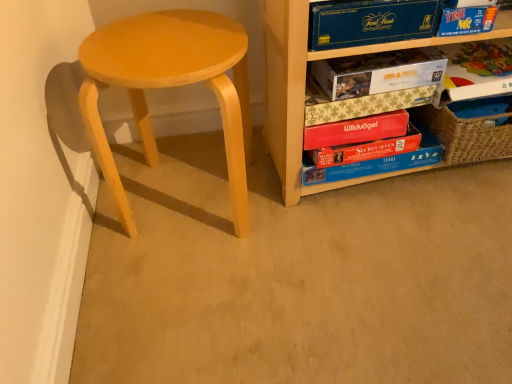
The image size is (512, 384). Identify the location of white paper at upper right, which is counted as the second paperback book, starting from the top. (475, 71).

The width and height of the screenshot is (512, 384). What do you see at coordinates (356, 130) in the screenshot?
I see `red matte wildvögel book at center, the fifth paperback book in the top-to-bottom sequence` at bounding box center [356, 130].

Describe the element at coordinates (359, 103) in the screenshot. I see `matte cardboard puzzle box at center-right, which is the fourth paperback book from bottom to top` at that location.

I want to click on blue cardboard book at upper right, which appears as the first paperback book when viewed from the top, so click(x=369, y=22).

I want to click on white paper at upper right, which is counted as the second paperback book, starting from the top, so click(475, 71).

Could you tell me if matte yellow stool at left is turned towards wooden puzzle boxes at right?

No, matte yellow stool at left is not turned towards wooden puzzle boxes at right.

Does point (242, 87) lie in front of point (276, 84)?

Yes, it is in front of point (276, 84).

What's the angular difference between matte yellow stool at left and wooden puzzle boxes at right's facing directions?

The angular difference between matte yellow stool at left and wooden puzzle boxes at right is 0.928 degrees.

Is wooden puzzle boxes at right a part of matte yellow stool at left?

No, wooden puzzle boxes at right is not a part of matte yellow stool at left.

From the picture: Can you see matte cardboard puzzle box at center-right, the fourth paperback book from the top, touching blue cardboard puzzle box at center, marked as the 7th paperback book in a top-to-bottom arrangement?

No, matte cardboard puzzle box at center-right, the fourth paperback book from the top, is not in contact with blue cardboard puzzle box at center, marked as the 7th paperback book in a top-to-bottom arrangement.

Considering their positions, is matte cardboard puzzle box at center-right, which is the fourth paperback book from bottom to top, located in front of or behind blue cardboard puzzle box at center, placed as the first paperback book when sorted from bottom to top?

Clearly, matte cardboard puzzle box at center-right, which is the fourth paperback book from bottom to top, is in front of blue cardboard puzzle box at center, placed as the first paperback book when sorted from bottom to top.

Considering the points (350, 105) and (432, 156), which point is behind, point (350, 105) or point (432, 156)?

The point (432, 156) is farther from the camera.

In terms of height, does matte cardboard puzzle box at center-right, which is the fourth paperback book from bottom to top, look taller or shorter compared to blue cardboard puzzle box at center, placed as the first paperback book when sorted from bottom to top?

Considering their sizes, matte cardboard puzzle box at center-right, which is the fourth paperback book from bottom to top, has less height than blue cardboard puzzle box at center, placed as the first paperback book when sorted from bottom to top.

The image size is (512, 384). I want to click on the 5th paperback book in front of the red cardboard book at center, the 6th paperback book from the top, so click(369, 22).

Is red cardboard book at center, placed as the second paperback book when sorted from bottom to top, aimed at blue cardboard book at upper right, which appears as the first paperback book when viewed from the top?

No, red cardboard book at center, placed as the second paperback book when sorted from bottom to top, is not aimed at blue cardboard book at upper right, which appears as the first paperback book when viewed from the top.

From the image's perspective, is red cardboard book at center, placed as the second paperback book when sorted from bottom to top, beneath blue cardboard book at upper right, which appears as the first paperback book when viewed from the top?

Indeed, from the image's perspective, red cardboard book at center, placed as the second paperback book when sorted from bottom to top, is shown beneath blue cardboard book at upper right, which appears as the first paperback book when viewed from the top.

Is blue cardboard puzzle box at center, placed as the first paperback book when sorted from bottom to top, bigger or smaller than wooden puzzle boxes at right?

Considering their sizes, blue cardboard puzzle box at center, placed as the first paperback book when sorted from bottom to top, takes up less space than wooden puzzle boxes at right.

How far apart are blue cardboard puzzle box at center, placed as the first paperback book when sorted from bottom to top, and wooden puzzle boxes at right?

blue cardboard puzzle box at center, placed as the first paperback book when sorted from bottom to top, is 6.24 inches from wooden puzzle boxes at right.

Is blue cardboard puzzle box at center, placed as the first paperback book when sorted from bottom to top, wider or thinner than wooden puzzle boxes at right?

blue cardboard puzzle box at center, placed as the first paperback book when sorted from bottom to top, is thinner than wooden puzzle boxes at right.

The image size is (512, 384). In order to click on shelf located above the blue cardboard puzzle box at center, placed as the first paperback book when sorted from bottom to top (from the image's perspective) in this screenshot , I will do click(x=304, y=86).

From the image's perspective, is blue cardboard puzzle box at center, placed as the first paperback book when sorted from bottom to top, on matte yellow stool at left?

No.

Does blue cardboard puzzle box at center, marked as the 7th paperback book in a top-to-bottom arrangement, have a smaller size compared to matte yellow stool at left?

Indeed, blue cardboard puzzle box at center, marked as the 7th paperback book in a top-to-bottom arrangement, has a smaller size compared to matte yellow stool at left.

Are blue cardboard puzzle box at center, placed as the first paperback book when sorted from bottom to top, and matte yellow stool at left making contact?

No, blue cardboard puzzle box at center, placed as the first paperback book when sorted from bottom to top, is not with matte yellow stool at left.

Visually, is blue cardboard puzzle box at center, placed as the first paperback book when sorted from bottom to top, positioned to the left or to the right of matte yellow stool at left?

blue cardboard puzzle box at center, placed as the first paperback book when sorted from bottom to top, is positioned on matte yellow stool at left's right side.

Is red matte wildvögel book at center, the fifth paperback book in the top-to-bottom sequence, not near red cardboard book at center, the 6th paperback book from the top?

No, red matte wildvögel book at center, the fifth paperback book in the top-to-bottom sequence, is not far from red cardboard book at center, the 6th paperback book from the top.

Between red matte wildvögel book at center, the 3th paperback book ordered from the bottom, and red cardboard book at center, placed as the second paperback book when sorted from bottom to top, which one has less height?

Standing shorter between the two is red cardboard book at center, placed as the second paperback book when sorted from bottom to top.

From a real-world perspective, between red matte wildvögel book at center, the 3th paperback book ordered from the bottom, and red cardboard book at center, the 6th paperback book from the top, who is vertically lower?

From a 3D spatial view, red cardboard book at center, the 6th paperback book from the top, is below.

Based on the photo, could red cardboard book at center, placed as the second paperback book when sorted from bottom to top, be considered to be inside red matte wildvögel book at center, the 3th paperback book ordered from the bottom?

Definitely not — red cardboard book at center, placed as the second paperback book when sorted from bottom to top, is not inside red matte wildvögel book at center, the 3th paperback book ordered from the bottom.

Would you say blue cardboard book at upper right, which appears as the 7th paperback book when ordered from the bottom, is a long distance from blue cardboard puzzle box at center, placed as the first paperback book when sorted from bottom to top?

Actually, blue cardboard book at upper right, which appears as the 7th paperback book when ordered from the bottom, and blue cardboard puzzle box at center, placed as the first paperback book when sorted from bottom to top, are a little close together.

Considering the positions of objects blue cardboard book at upper right, which appears as the first paperback book when viewed from the top, and blue cardboard puzzle box at center, marked as the 7th paperback book in a top-to-bottom arrangement, in the image provided, who is more to the right, blue cardboard book at upper right, which appears as the first paperback book when viewed from the top, or blue cardboard puzzle box at center, marked as the 7th paperback book in a top-to-bottom arrangement,?

→ From the viewer's perspective, blue cardboard puzzle box at center, marked as the 7th paperback book in a top-to-bottom arrangement, appears more on the right side.

How many degrees apart are the facing directions of blue cardboard book at upper right, which appears as the 7th paperback book when ordered from the bottom, and blue cardboard puzzle box at center, marked as the 7th paperback book in a top-to-bottom arrangement?

The angle between the facing direction of blue cardboard book at upper right, which appears as the 7th paperback book when ordered from the bottom, and the facing direction of blue cardboard puzzle box at center, marked as the 7th paperback book in a top-to-bottom arrangement, is 0.46 degrees.

I want to click on the 6th paperback book behind the blue cardboard book at upper right, which appears as the first paperback book when viewed from the top, so click(376, 163).

This screenshot has height=384, width=512. In order to click on shelf that appears above the matte yellow stool at left (from a real-world perspective) in this screenshot , I will do `click(304, 86)`.

Starting from the blue cardboard puzzle box at center, marked as the 7th paperback book in a top-to-bottom arrangement, which paperback book is the 4th one in front? Please provide its 2D coordinates.

[(359, 103)]

From the image, which object appears to be nearer to red matte wildvögel book at center, the fifth paperback book in the top-to-bottom sequence, matte cardboard puzzle box at center-right, which is the fourth paperback book from bottom to top, or white paper at upper right, which is counted as the second paperback book, starting from the top?

Among the two, matte cardboard puzzle box at center-right, which is the fourth paperback book from bottom to top, is located nearer to red matte wildvögel book at center, the fifth paperback book in the top-to-bottom sequence.

From the image, which object appears to be nearer to wooden puzzle boxes at right, matte yellow stool at left or red matte wildvögel book at center, the fifth paperback book in the top-to-bottom sequence?

red matte wildvögel book at center, the fifth paperback book in the top-to-bottom sequence, is positioned closer to the anchor wooden puzzle boxes at right.

Which object lies further to the anchor point blue cardboard book at upper right, which appears as the first paperback book when viewed from the top, matte yellow stool at left or matte cardboard puzzle box at center-right, which is the fourth paperback book from bottom to top?

Based on the image, matte yellow stool at left appears to be further to blue cardboard book at upper right, which appears as the first paperback book when viewed from the top.

When comparing their distances from red matte wildvögel book at center, the fifth paperback book in the top-to-bottom sequence, does white paper at upper right, which is the 6th paperback book in bottom-to-top order, or wooden puzzle boxes at right seem closer?

wooden puzzle boxes at right is positioned closer to the anchor red matte wildvögel book at center, the fifth paperback book in the top-to-bottom sequence.

Based on their spatial positions, is matte yellow stool at left or red matte wildvögel book at center, the 3th paperback book ordered from the bottom, closer to matte cardboard puzzle box at center-right, the fourth paperback book from the top?

Among the two, red matte wildvögel book at center, the 3th paperback book ordered from the bottom, is located nearer to matte cardboard puzzle box at center-right, the fourth paperback book from the top.

Estimate the real-world distances between objects in this image. Which object is further from red cardboard book at center, the 6th paperback book from the top, matte cardboard puzzle box at center-right, the fourth paperback book from the top, or matte cardboard puzzle at upper center, which appears as the 5th paperback book when ordered from the bottom?

matte cardboard puzzle at upper center, which appears as the 5th paperback book when ordered from the bottom, lies further to red cardboard book at center, the 6th paperback book from the top, than the other object.

In the scene shown: Looking at the image, which one is located closer to matte cardboard puzzle box at center-right, the fourth paperback book from the top, blue cardboard book at upper right, which appears as the first paperback book when viewed from the top, or matte yellow stool at left?

blue cardboard book at upper right, which appears as the first paperback book when viewed from the top, is closer to matte cardboard puzzle box at center-right, the fourth paperback book from the top.

When comparing their distances from blue cardboard puzzle box at center, placed as the first paperback book when sorted from bottom to top, does white paper at upper right, which is the 6th paperback book in bottom-to-top order, or matte cardboard puzzle at upper center, which appears as the 5th paperback book when ordered from the bottom, seem further?

The object further to blue cardboard puzzle box at center, placed as the first paperback book when sorted from bottom to top, is white paper at upper right, which is the 6th paperback book in bottom-to-top order.

At what (x,y) coordinates should I click in order to perform the action: click on shelf situated between red matte wildvögel book at center, the fifth paperback book in the top-to-bottom sequence, and white paper at upper right, which is counted as the second paperback book, starting from the top, from left to right. Please return your answer as a coordinate pair (x, y). The width and height of the screenshot is (512, 384). Looking at the image, I should click on (304, 86).

Where is `paperback book between matte cardboard puzzle at upper center, which appears as the 5th paperback book when ordered from the bottom, and red matte wildvögel book at center, the fifth paperback book in the top-to-bottom sequence, vertically`? The width and height of the screenshot is (512, 384). paperback book between matte cardboard puzzle at upper center, which appears as the 5th paperback book when ordered from the bottom, and red matte wildvögel book at center, the fifth paperback book in the top-to-bottom sequence, vertically is located at coordinates (359, 103).

At what (x,y) coordinates should I click in order to perform the action: click on paperback book between blue cardboard puzzle box at center, marked as the 7th paperback book in a top-to-bottom arrangement, and white paper at upper right, which is counted as the second paperback book, starting from the top, from left to right. Please return your answer as a coordinate pair (x, y). Looking at the image, I should click on (379, 72).

In order to click on shelf between matte yellow stool at left and white paper at upper right, which is counted as the second paperback book, starting from the top, from left to right in this screenshot , I will do (x=304, y=86).